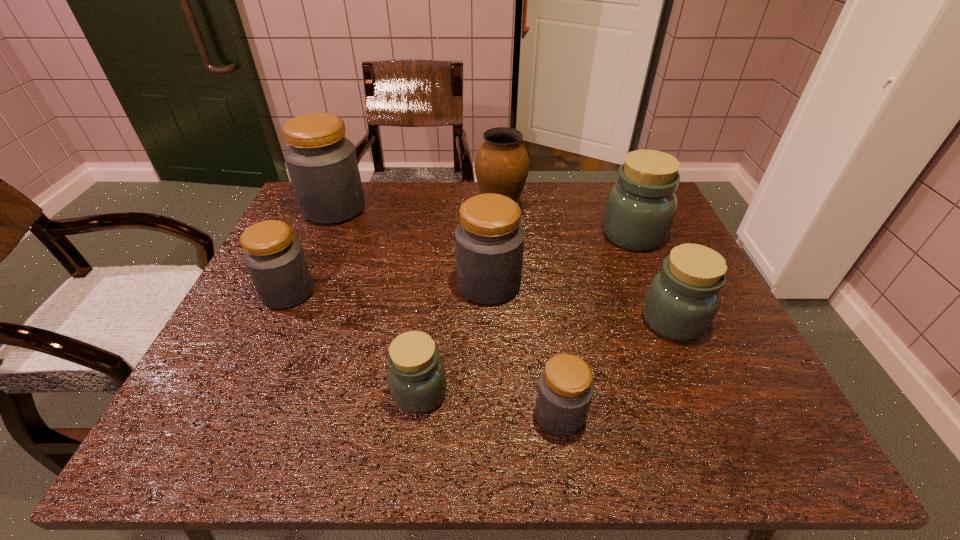
Find the location of a particular element. The image size is (960, 540). the tallest jar is located at coordinates (322, 164).

Where is `the farthest gray jar`? Image resolution: width=960 pixels, height=540 pixels. the farthest gray jar is located at coordinates (322, 164).

Where is `brown urn`? The image size is (960, 540). brown urn is located at coordinates (501, 165).

This screenshot has height=540, width=960. I want to click on the farthest green jar, so click(640, 209).

Identify the location of the second biggest gray jar. (489, 241).

Where is `the second gray jar from right to left`? The height and width of the screenshot is (540, 960). the second gray jar from right to left is located at coordinates (489, 241).

Identify the location of the third biggest gray jar. The width and height of the screenshot is (960, 540). 275,260.

Identify the location of the second farthest green jar. Image resolution: width=960 pixels, height=540 pixels. (682, 300).

Locate an element on the screen. This screenshot has width=960, height=540. the sixth object from right to left is located at coordinates (416, 375).

Identify the location of the nearest green jar. (416, 375).